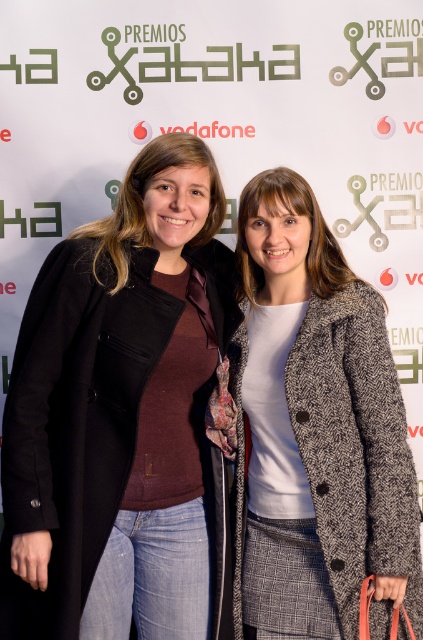
Question: Can you confirm if matte black coat at center is thinner than white textured coat at center?

Choices:
 (A) yes
 (B) no

Answer: (B)

Question: In this image, where is matte black coat at center located relative to white textured coat at center?

Choices:
 (A) left
 (B) right

Answer: (A)

Question: Can you confirm if matte black coat at center is wider than white textured coat at center?

Choices:
 (A) no
 (B) yes

Answer: (B)

Question: Which of the following is the farthest from the observer?

Choices:
 (A) white textured coat at center
 (B) matte black coat at center

Answer: (A)